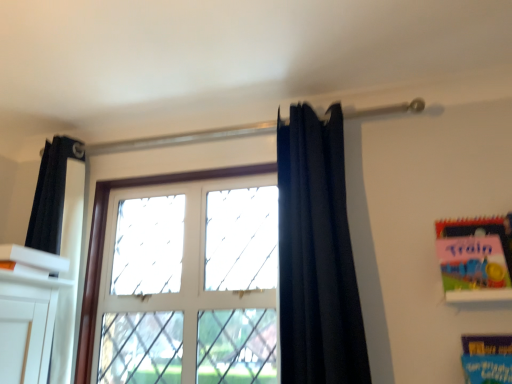
Question: Considering the relative sizes of matte pink paper at upper right, the 2th paperback book when ordered from bottom to top, and white glass window at center in the image provided, is matte pink paper at upper right, the 2th paperback book when ordered from bottom to top, bigger than white glass window at center?

Choices:
 (A) no
 (B) yes

Answer: (A)

Question: Is matte pink paper at upper right, the 2th paperback book when ordered from bottom to top, not within white glass window at center?

Choices:
 (A) yes
 (B) no

Answer: (A)

Question: Is matte pink paper at upper right, the 2th paperback book when ordered from bottom to top, looking in the opposite direction of white glass window at center?

Choices:
 (A) no
 (B) yes

Answer: (A)

Question: Can you confirm if matte pink paper at upper right, the 2th paperback book when ordered from bottom to top, is smaller than white glass window at center?

Choices:
 (A) no
 (B) yes

Answer: (B)

Question: Is matte pink paper at upper right, the 2th paperback book when ordered from bottom to top, taller than white glass window at center?

Choices:
 (A) yes
 (B) no

Answer: (B)

Question: Considering the relative sizes of matte pink paper at upper right, the 2th paperback book when ordered from bottom to top, and white glass window at center in the image provided, is matte pink paper at upper right, the 2th paperback book when ordered from bottom to top, thinner than white glass window at center?

Choices:
 (A) yes
 (B) no

Answer: (A)

Question: Would you say white glass window at center contains blue cardboard book at lower right, marked as the first paperback book in a bottom-to-top arrangement?

Choices:
 (A) yes
 (B) no

Answer: (B)

Question: From a real-world perspective, is white glass window at center physically below blue cardboard book at lower right, the second paperback book in the top-to-bottom sequence?

Choices:
 (A) yes
 (B) no

Answer: (B)

Question: Is white glass window at center smaller than blue cardboard book at lower right, the second paperback book in the top-to-bottom sequence?

Choices:
 (A) yes
 (B) no

Answer: (B)

Question: Is white glass window at center bigger than blue cardboard book at lower right, the second paperback book in the top-to-bottom sequence?

Choices:
 (A) no
 (B) yes

Answer: (B)

Question: From the image's perspective, is white glass window at center located beneath blue cardboard book at lower right, the second paperback book in the top-to-bottom sequence?

Choices:
 (A) yes
 (B) no

Answer: (B)

Question: From a real-world perspective, is white glass window at center located higher than blue cardboard book at lower right, the second paperback book in the top-to-bottom sequence?

Choices:
 (A) yes
 (B) no

Answer: (A)

Question: From the image's perspective, is dark blue fabric at center over matte pink paper at upper right, positioned as the 1th paperback book in top-to-bottom order?

Choices:
 (A) yes
 (B) no

Answer: (A)